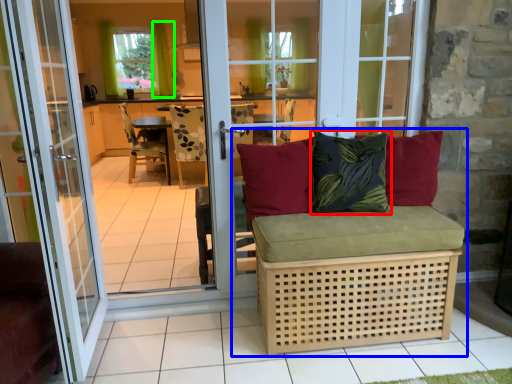
Question: Based on their relative distances, which object is nearer to pillow (highlighted by a red box)? Choose from studio couch (highlighted by a blue box) and curtain (highlighted by a green box).

Choices:
 (A) studio couch
 (B) curtain

Answer: (A)